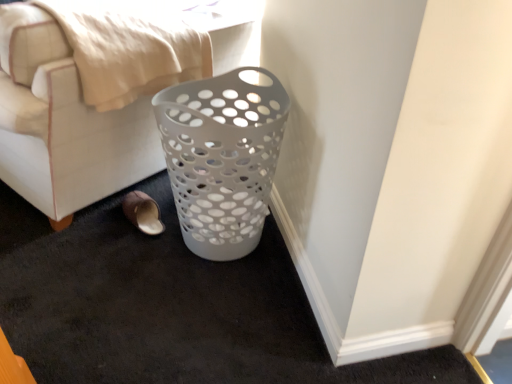
Question: Is white plastic laundry basket at lower center facing towards white plastic basket at lower right?

Choices:
 (A) no
 (B) yes

Answer: (A)

Question: Is white plastic laundry basket at lower center outside white plastic basket at lower right?

Choices:
 (A) yes
 (B) no

Answer: (A)

Question: From a real-world perspective, is white plastic laundry basket at lower center located higher than white plastic basket at lower right?

Choices:
 (A) no
 (B) yes

Answer: (B)

Question: From the image's perspective, is white plastic laundry basket at lower center located beneath white plastic basket at lower right?

Choices:
 (A) yes
 (B) no

Answer: (B)

Question: Can you confirm if white plastic laundry basket at lower center is thinner than white plastic basket at lower right?

Choices:
 (A) no
 (B) yes

Answer: (A)

Question: Is point (216, 243) closer or farther from the camera than point (23, 196)?

Choices:
 (A) farther
 (B) closer

Answer: (B)

Question: From their relative heights in the image, would you say white plastic basket at lower right is taller or shorter than white plastic laundry basket at lower center?

Choices:
 (A) short
 (B) tall

Answer: (A)

Question: From the image's perspective, is white plastic basket at lower right above or below white plastic laundry basket at lower center?

Choices:
 (A) above
 (B) below

Answer: (B)

Question: In the image, is white plastic basket at lower right positioned in front of or behind white plastic laundry basket at lower center?

Choices:
 (A) behind
 (B) front

Answer: (A)

Question: In the image, is brown suede slipper at lower left positioned in front of or behind white plastic laundry basket at lower center?

Choices:
 (A) behind
 (B) front

Answer: (A)

Question: From a real-world perspective, is brown suede slipper at lower left physically located above or below white plastic laundry basket at lower center?

Choices:
 (A) below
 (B) above

Answer: (A)

Question: Would you say brown suede slipper at lower left is to the left or to the right of white plastic laundry basket at lower center in the picture?

Choices:
 (A) left
 (B) right

Answer: (B)

Question: From their relative heights in the image, would you say brown suede slipper at lower left is taller or shorter than white plastic laundry basket at lower center?

Choices:
 (A) tall
 (B) short

Answer: (B)

Question: Would you say white plastic laundry basket at lower center is to the left or to the right of white plastic basket at lower right in the picture?

Choices:
 (A) right
 (B) left

Answer: (B)

Question: Considering the positions of white plastic laundry basket at lower center and white plastic basket at lower right in the image, is white plastic laundry basket at lower center wider or thinner than white plastic basket at lower right?

Choices:
 (A) wide
 (B) thin

Answer: (A)